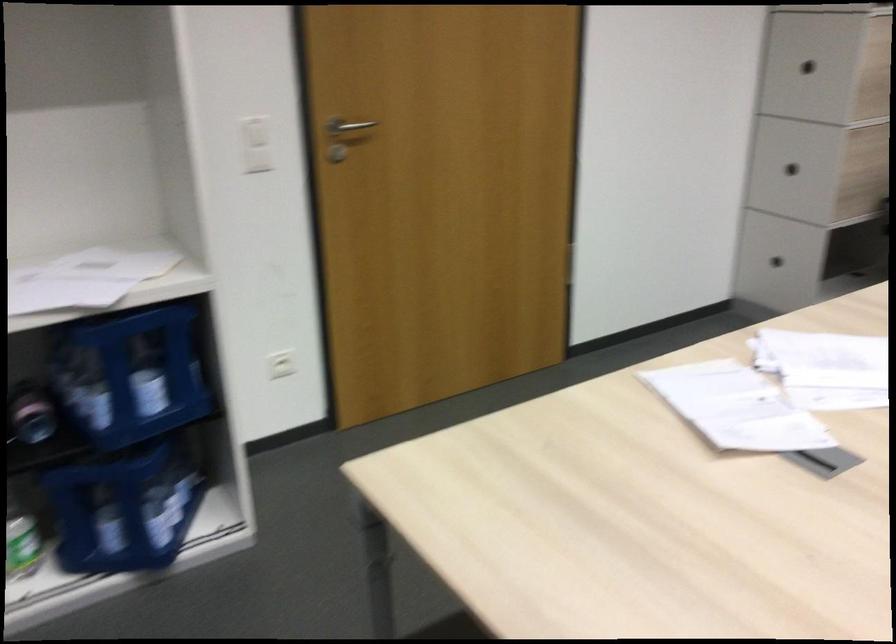
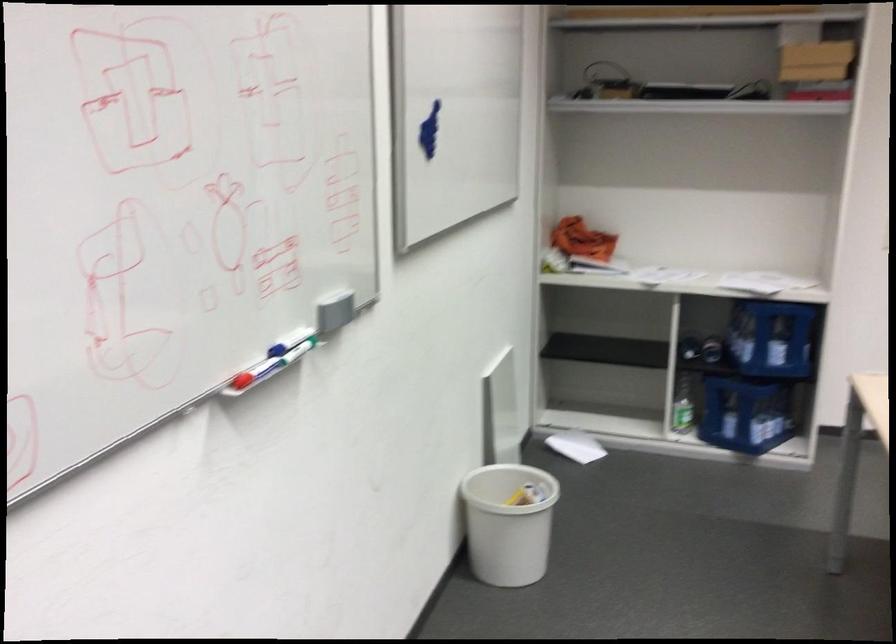
Locate, in the second image, the point that corresponds to pixel 141 515 in the first image.

(745, 413)